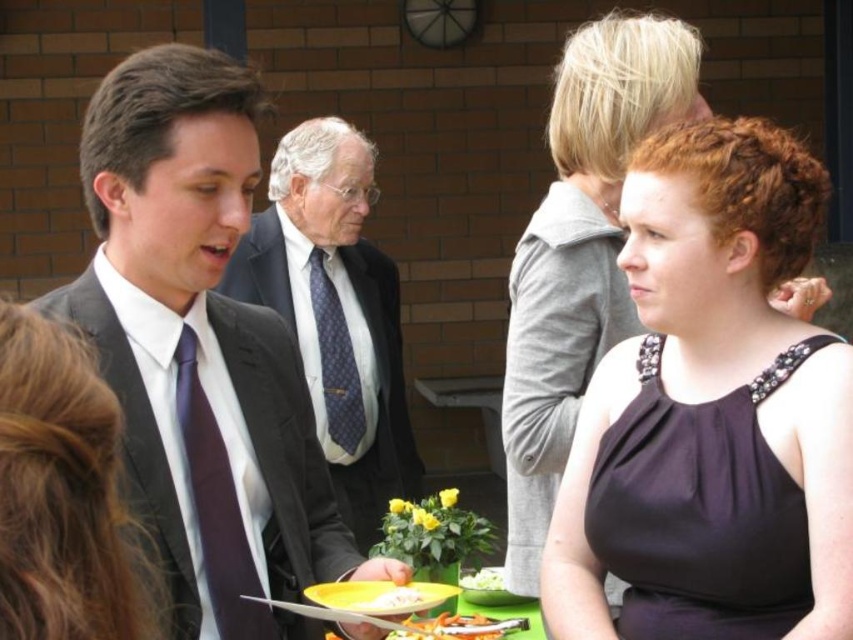
Consider the image. Does black satin dress at center have a greater height compared to matte black suit at left?

Incorrect, black satin dress at center's height is not larger of matte black suit at left's.

Find the location of `black satin dress at center`. black satin dress at center is located at coordinates (712, 408).

At what (x,y) coordinates should I click in order to perform the action: click on matte black suit at left. Please return your answer as a coordinate pair (x, y). This screenshot has height=640, width=853. Looking at the image, I should click on (201, 349).

Does matte black suit at left have a lesser height compared to yellow plastic plate at lower center?

No, matte black suit at left is not shorter than yellow plastic plate at lower center.

Which is behind, point (364, 572) or point (370, 595)?

The point (364, 572) is more distant.

Identify the location of matte black suit at left. (201, 349).

Who is taller, purple silk tie at center or yellow plastic plate at lower center?

Standing taller between the two is purple silk tie at center.

Which is below, purple silk tie at center or yellow plastic plate at lower center?

Positioned lower is yellow plastic plate at lower center.

Is point (230, 490) closer to viewer compared to point (343, 604)?

No, it is not.

Find the location of `purple silk tie at center`. purple silk tie at center is located at coordinates (218, 508).